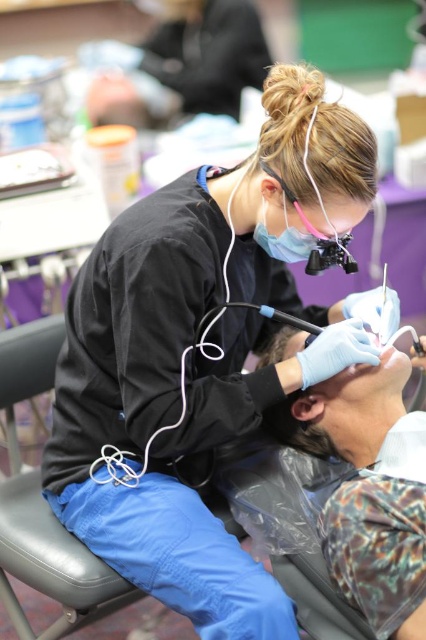
What do you see at coordinates (379, 552) in the screenshot? The image size is (426, 640). I see `matte blue shirt at center` at bounding box center [379, 552].

Which of these two, matte blue shirt at center or black leather chair at lower left, stands taller?

Standing taller between the two is black leather chair at lower left.

Identify the location of matte blue shirt at center. (379, 552).

Locate an element on the screen. This screenshot has width=426, height=640. matte blue shirt at center is located at coordinates (379, 552).